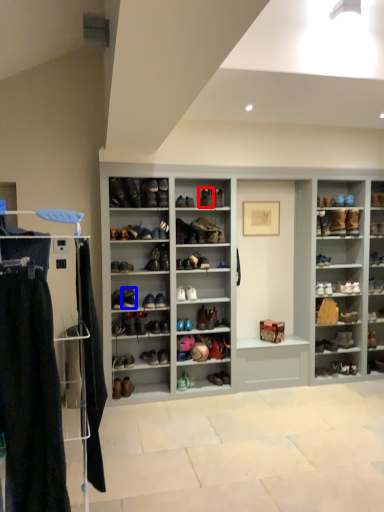
Question: Which of the following is the closest to the observer, shoe (highlighted by a red box) or footwear (highlighted by a blue box)?

Choices:
 (A) shoe
 (B) footwear

Answer: (B)